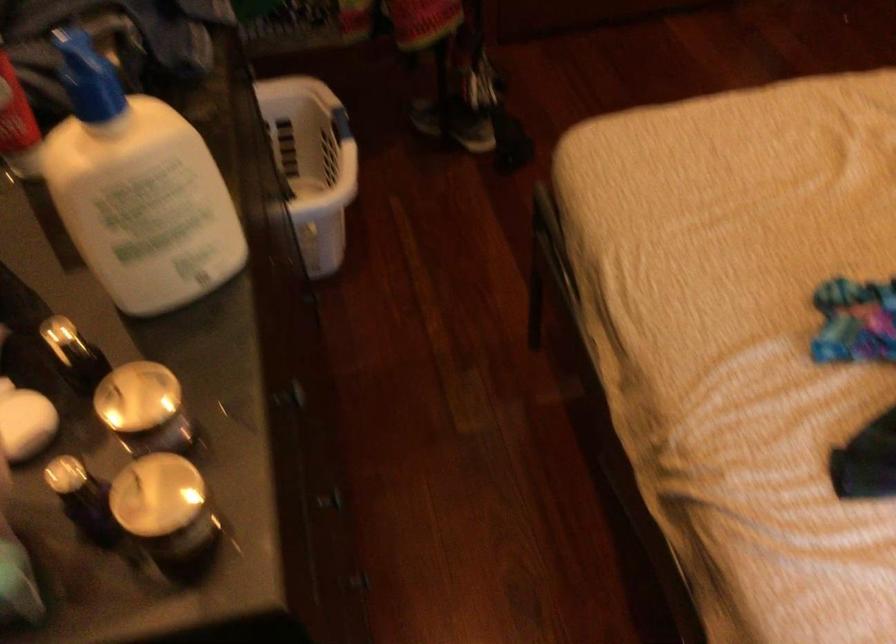
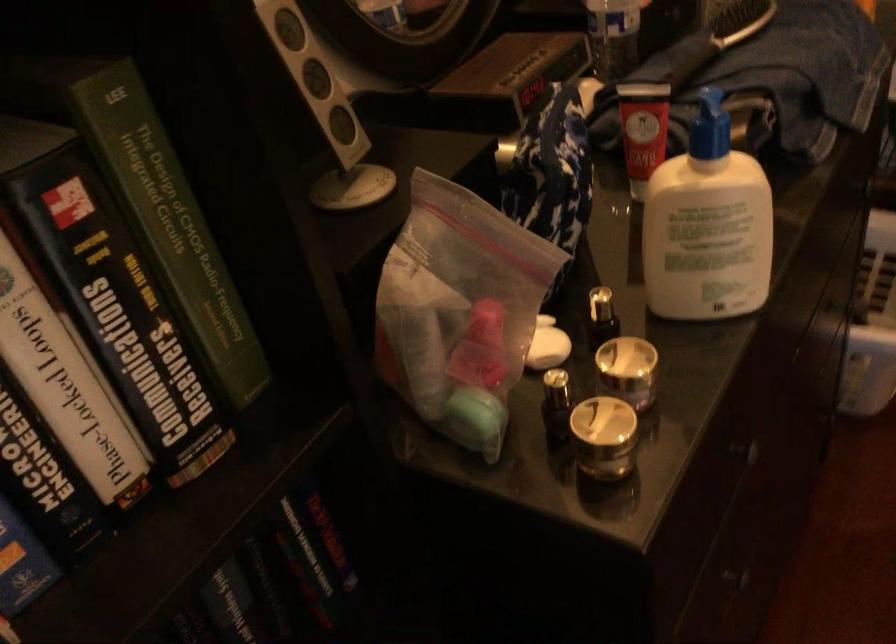
In the second image, find the point that corresponds to (x=154, y=194) in the first image.

(707, 225)